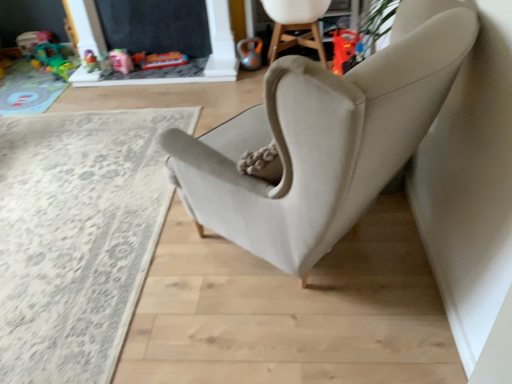
What are the coordinates of `free region on the left part of suede beige armchair at upper center` in the screenshot? It's located at (236, 91).